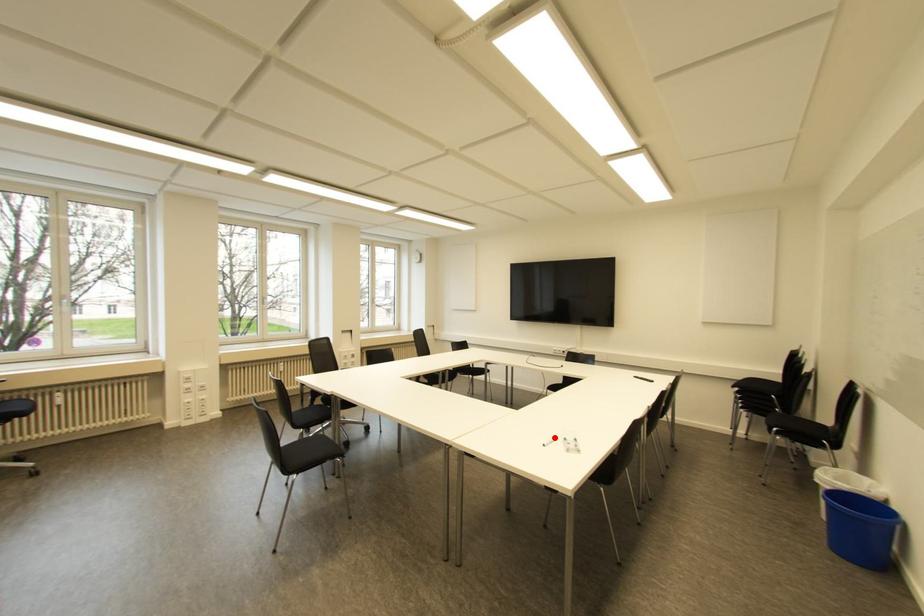
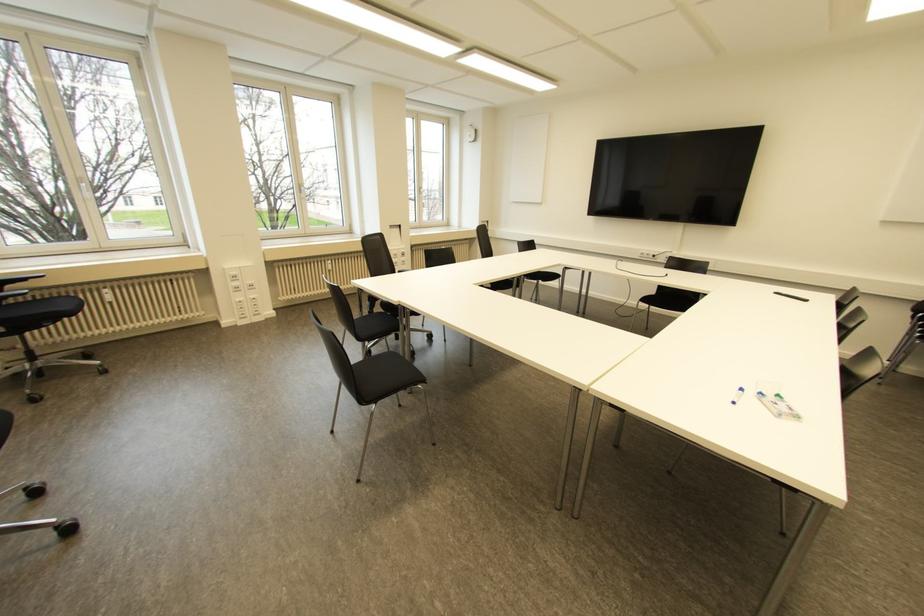
Find the pixel in the second image that matches the highlighted location in the first image.

(739, 390)